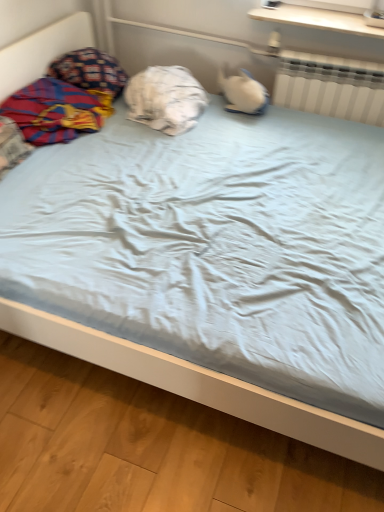
Question: Is white plastic radiator at upper right aimed at white wood shelf at upper center?

Choices:
 (A) yes
 (B) no

Answer: (B)

Question: Is white wood shelf at upper center inside white plastic radiator at upper right?

Choices:
 (A) no
 (B) yes

Answer: (A)

Question: Is white plastic radiator at upper right far from white wood shelf at upper center?

Choices:
 (A) no
 (B) yes

Answer: (A)

Question: From a real-world perspective, does white plastic radiator at upper right sit lower than white wood shelf at upper center?

Choices:
 (A) no
 (B) yes

Answer: (B)

Question: Is white plastic radiator at upper right shorter than white wood shelf at upper center?

Choices:
 (A) yes
 (B) no

Answer: (B)

Question: Relative to plaid fabric blanket at left, is white cotton pillow at center, positioned as the 1th pillow in right-to-left order, in front or behind?

Choices:
 (A) front
 (B) behind

Answer: (B)

Question: Is point (172, 74) positioned closer to the camera than point (74, 96)?

Choices:
 (A) farther
 (B) closer

Answer: (A)

Question: Considering the positions of white cotton pillow at center, positioned as the 1th pillow in right-to-left order, and plaid fabric blanket at left in the image, is white cotton pillow at center, positioned as the 1th pillow in right-to-left order, bigger or smaller than plaid fabric blanket at left?

Choices:
 (A) small
 (B) big

Answer: (B)

Question: From the image's perspective, relative to plaid fabric blanket at left, is white cotton pillow at center, positioned as the 1th pillow in right-to-left order, above or below?

Choices:
 (A) below
 (B) above

Answer: (B)

Question: From the image's perspective, is plaid fabric blanket at left above or below white cotton pillow at center, the 2th pillow from the left?

Choices:
 (A) above
 (B) below

Answer: (B)

Question: From a real-world perspective, relative to white cotton pillow at center, positioned as the 1th pillow in right-to-left order, is plaid fabric blanket at left vertically above or below?

Choices:
 (A) above
 (B) below

Answer: (B)

Question: Is plaid fabric blanket at left spatially inside white cotton pillow at center, the 2th pillow from the left, or outside of it?

Choices:
 (A) outside
 (B) inside

Answer: (A)

Question: In terms of height, does plaid fabric blanket at left look taller or shorter compared to white cotton pillow at center, the 2th pillow from the left?

Choices:
 (A) tall
 (B) short

Answer: (B)

Question: In terms of height, does plaid fabric blanket at left look taller or shorter compared to white plastic radiator at upper right?

Choices:
 (A) short
 (B) tall

Answer: (A)

Question: Relative to white plastic radiator at upper right, is plaid fabric blanket at left in front or behind?

Choices:
 (A) behind
 (B) front

Answer: (B)